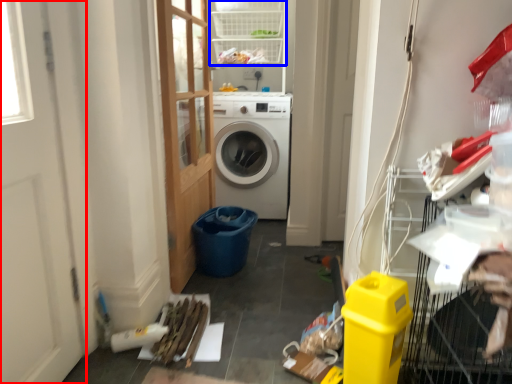
Question: Which point is further to the camera, screen door (highlighted by a red box) or shelf (highlighted by a blue box)?

Choices:
 (A) screen door
 (B) shelf

Answer: (B)